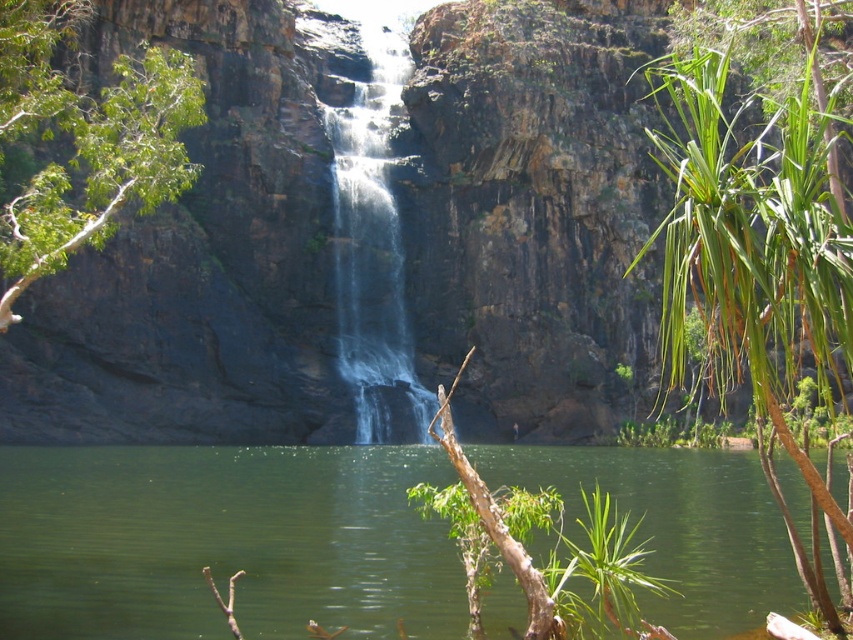
Question: Which object appears closest to the camera in this image?

Choices:
 (A) green liquid water at center
 (B) clear water at center

Answer: (A)

Question: Is green leafy tree at upper left to the right of clear water at center from the viewer's perspective?

Choices:
 (A) yes
 (B) no

Answer: (B)

Question: Is green liquid water at center below green leafy plant at right?

Choices:
 (A) yes
 (B) no

Answer: (A)

Question: Which object appears closest to the camera in this image?

Choices:
 (A) green liquid water at center
 (B) green leafy plant at right
 (C) green leafy tree at upper left

Answer: (B)

Question: Among these objects, which one is nearest to the camera?

Choices:
 (A) green liquid water at center
 (B) clear water at center
 (C) green leafy tree at upper left
 (D) green leafy plant at right

Answer: (D)

Question: Is green liquid water at center bigger than green leafy plant at right?

Choices:
 (A) yes
 (B) no

Answer: (B)